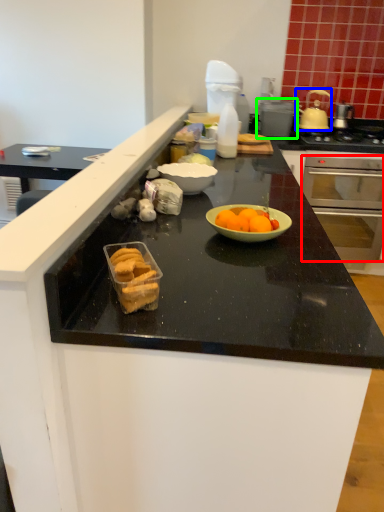
Question: Which object is the closest to the oven (highlighted by a red box)? Choose among these: pot/pan (highlighted by a blue box) or appliance (highlighted by a green box).

Choices:
 (A) pot/pan
 (B) appliance

Answer: (B)